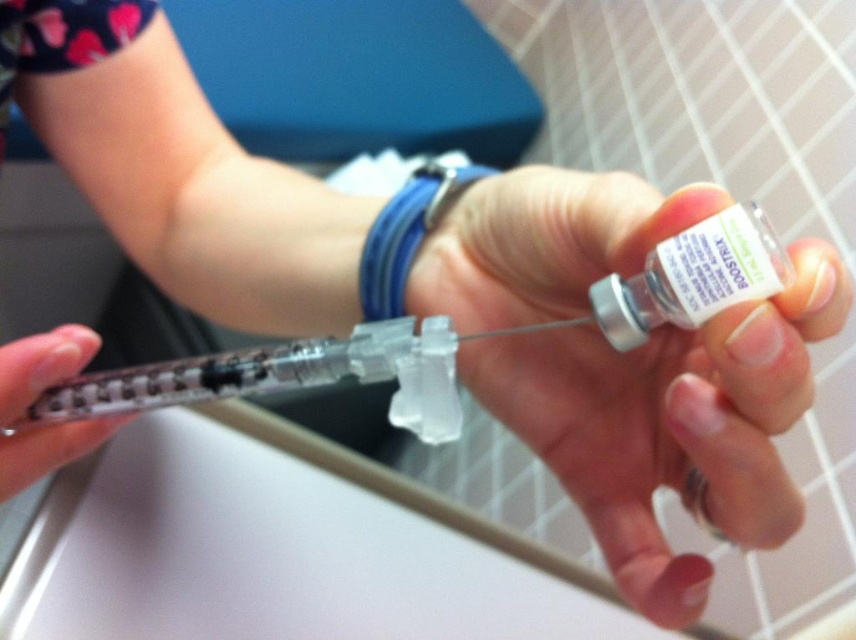
Question: Considering the real-world distances, which object is farthest from the transparent plastic syringe at center?

Choices:
 (A) blue rubber band at center
 (B) clear plastic vial at center
 (C) clear plastic syringe at lower left

Answer: (A)

Question: Considering the real-world distances, which object is closest to the clear plastic vial at center?

Choices:
 (A) clear plastic syringe at lower left
 (B) blue rubber band at center

Answer: (B)

Question: Which of the following is the closest to the observer?

Choices:
 (A) blue rubber band at center
 (B) clear plastic syringe at lower left

Answer: (B)

Question: Is clear plastic vial at center further to camera compared to clear plastic syringe at lower left?

Choices:
 (A) yes
 (B) no

Answer: (B)

Question: Is clear plastic vial at center further to camera compared to clear plastic syringe at lower left?

Choices:
 (A) no
 (B) yes

Answer: (A)

Question: Is clear plastic vial at center positioned before transparent plastic syringe at center?

Choices:
 (A) yes
 (B) no

Answer: (B)